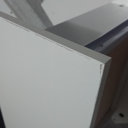
Locate an element on the screen. stand is located at coordinates (30, 13).